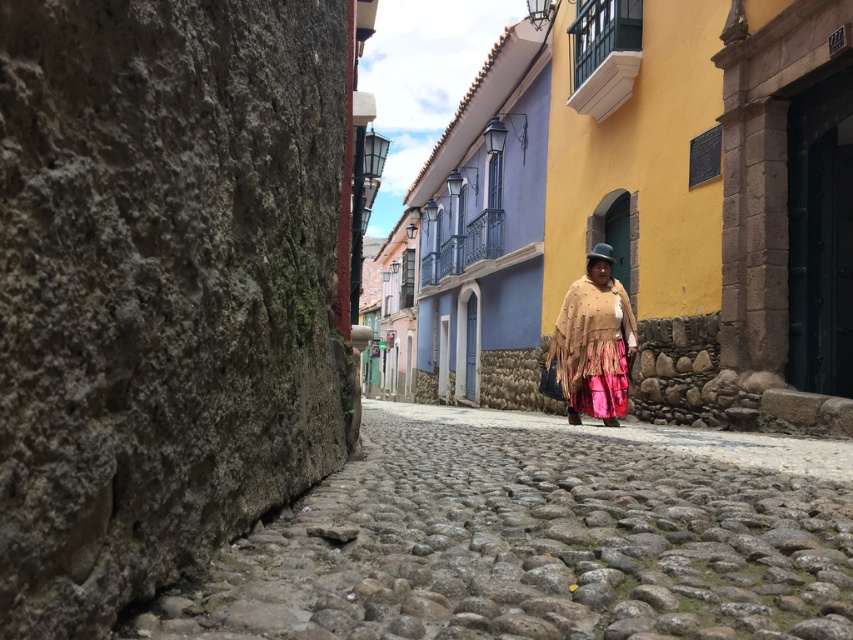
Question: Among these objects, which one is farthest from the camera?

Choices:
 (A) gray cobblestone path at center
 (B) beige fringed poncho at center
 (C) cobblestone street at center

Answer: (B)

Question: Is gray cobblestone path at center bigger than cobblestone street at center?

Choices:
 (A) yes
 (B) no

Answer: (B)

Question: Which is nearer to the beige fringed poncho at center?

Choices:
 (A) gray cobblestone path at center
 (B) cobblestone street at center

Answer: (A)

Question: Is gray cobblestone path at center to the right of beige fringed poncho at center from the viewer's perspective?

Choices:
 (A) yes
 (B) no

Answer: (B)

Question: Where is gray cobblestone path at center located in relation to beige fringed poncho at center in the image?

Choices:
 (A) below
 (B) above

Answer: (A)

Question: Which object is the closest to the cobblestone street at center?

Choices:
 (A) beige fringed poncho at center
 (B) gray cobblestone path at center

Answer: (A)